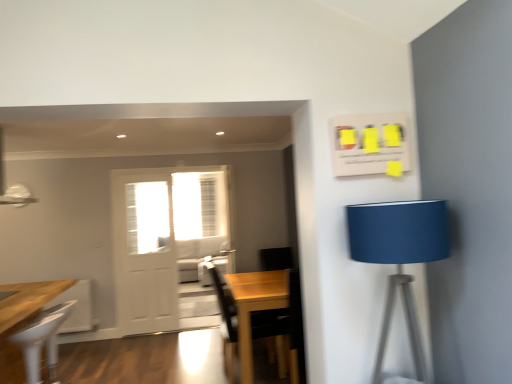
Identify the location of vacant area on top of white glossy screen door at center (from a real-world perspective). (137, 167).